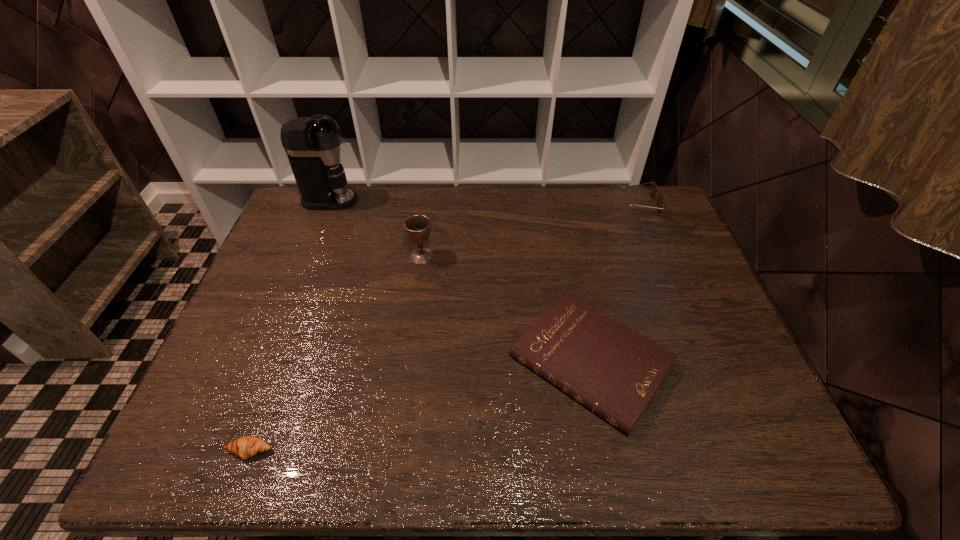
Locate an element on the screen. The height and width of the screenshot is (540, 960). vacant space located 0.110m on the front-facing side of the rightmost object is located at coordinates (592, 204).

Find the location of a particular element. vacant position located on the front-facing side of the rightmost object is located at coordinates (517, 204).

Identify the location of free space located on the front-facing side of the rightmost object. (529, 204).

What are the coordinates of `vacant space located 0.130m on the left of the fourth object from left to right` in the screenshot? It's located at (457, 361).

This screenshot has height=540, width=960. In order to click on coffee maker located at the far edge in this screenshot , I will do `click(313, 145)`.

Identify the location of spectacles situated at the far edge. This screenshot has height=540, width=960. (653, 189).

Identify the location of hardback book at the near edge. (613, 371).

The image size is (960, 540). In order to click on pastry that is at the near edge in this screenshot , I will do `click(245, 447)`.

Where is `coffee maker located in the left edge section of the desktop`? coffee maker located in the left edge section of the desktop is located at coordinates (313, 145).

Where is `pastry at the left edge`? The width and height of the screenshot is (960, 540). pastry at the left edge is located at coordinates (245, 447).